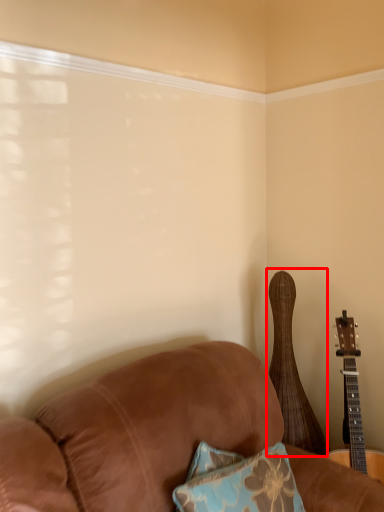
Question: Where is guitar (annotated by the red box) located in relation to guitar in the image?

Choices:
 (A) right
 (B) left

Answer: (B)